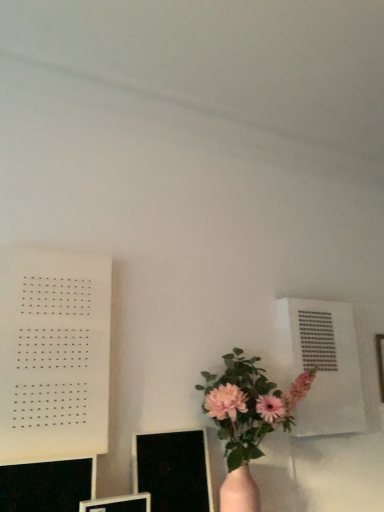
Question: From a real-world perspective, is white paper at left below pink matte vase at lower center?

Choices:
 (A) yes
 (B) no

Answer: (B)

Question: Is white paper at left bigger than pink matte vase at lower center?

Choices:
 (A) yes
 (B) no

Answer: (B)

Question: Is white paper at left far from pink matte vase at lower center?

Choices:
 (A) no
 (B) yes

Answer: (A)

Question: From the image's perspective, is white paper at left located beneath pink matte vase at lower center?

Choices:
 (A) no
 (B) yes

Answer: (A)

Question: From the image's perspective, does white paper at left appear higher than pink matte vase at lower center?

Choices:
 (A) no
 (B) yes

Answer: (B)

Question: Is point (201, 408) positioned closer to the camera than point (210, 494)?

Choices:
 (A) closer
 (B) farther

Answer: (B)

Question: From their relative heights in the image, would you say pink matte vase at lower center is taller or shorter than black glossy computer monitor at lower center, acting as the first computer monitor starting from the right?

Choices:
 (A) short
 (B) tall

Answer: (B)

Question: Considering the positions of pink matte vase at lower center and black glossy computer monitor at lower center, acting as the first computer monitor starting from the right, in the image, is pink matte vase at lower center bigger or smaller than black glossy computer monitor at lower center, acting as the first computer monitor starting from the right,?

Choices:
 (A) small
 (B) big

Answer: (B)

Question: In the image, is pink matte vase at lower center positioned in front of or behind black glossy computer monitor at lower center, which appears as the 3th computer monitor when viewed from the left?

Choices:
 (A) behind
 (B) front

Answer: (B)

Question: Visually, is black glossy computer monitor at lower center, which appears as the 3th computer monitor when viewed from the left, positioned to the left or to the right of pink matte vase at lower center?

Choices:
 (A) left
 (B) right

Answer: (A)

Question: Considering the positions of point (198, 485) and point (253, 412), is point (198, 485) closer or farther from the camera than point (253, 412)?

Choices:
 (A) closer
 (B) farther

Answer: (B)

Question: Is black glossy computer monitor at lower center, acting as the first computer monitor starting from the right, spatially inside pink matte vase at lower center, or outside of it?

Choices:
 (A) outside
 (B) inside

Answer: (A)

Question: From the image's perspective, is black glossy computer monitor at lower center, acting as the first computer monitor starting from the right, positioned above or below pink matte vase at lower center?

Choices:
 (A) below
 (B) above

Answer: (A)

Question: From a real-world perspective, is black glossy computer monitor at lower center, which appears as the 3th computer monitor when viewed from the left, positioned above or below white paper at left?

Choices:
 (A) below
 (B) above

Answer: (A)

Question: Is point (187, 443) positioned closer to the camera than point (16, 368)?

Choices:
 (A) closer
 (B) farther

Answer: (B)